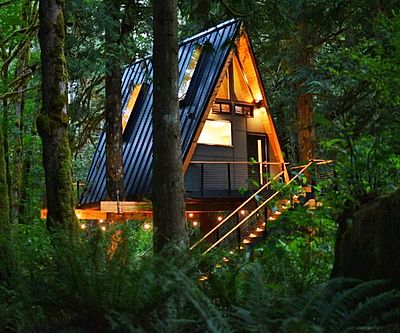
Find the location of `space underneath large window`. space underneath large window is located at coordinates (212, 153).